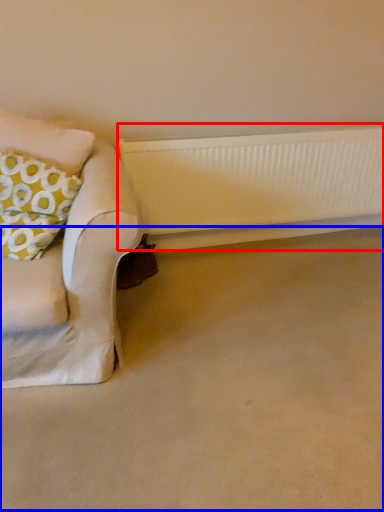
Question: Which point is closer to the camera, radiator (highlighted by a red box) or plain (highlighted by a blue box)?

Choices:
 (A) radiator
 (B) plain

Answer: (B)